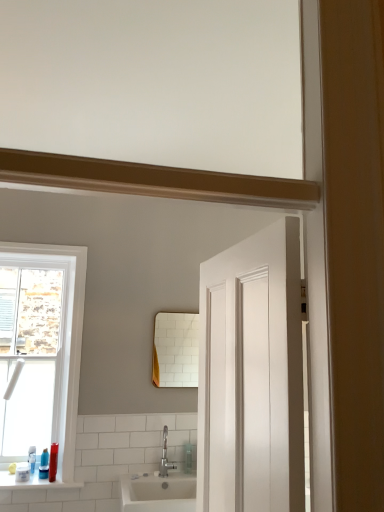
The height and width of the screenshot is (512, 384). I want to click on free point in front of translucent plastic soap at lower left, which ranks as the second toiletry in right-to-left order, so click(23, 481).